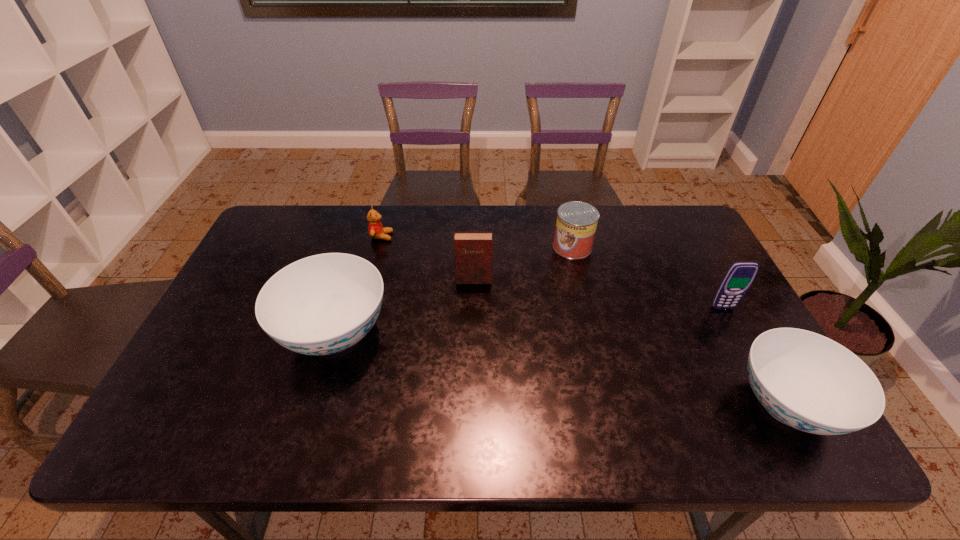
Identify the location of the left chinaware. Image resolution: width=960 pixels, height=540 pixels. (323, 304).

The width and height of the screenshot is (960, 540). Find the location of `the shorter chinaware`. the shorter chinaware is located at coordinates (805, 380).

Find the location of a particular element. Image resolution: width=960 pixels, height=540 pixels. the shortest object is located at coordinates (375, 228).

What are the coordinates of `cellular telephone` in the screenshot? It's located at (739, 277).

Identify the location of the third object from right to left. The height and width of the screenshot is (540, 960). (576, 224).

At what (x,y) coordinates should I click in order to perform the action: click on diary. Please return your answer as a coordinate pair (x, y). Looking at the image, I should click on (473, 251).

Where is `the fourth nearest object`? The image size is (960, 540). the fourth nearest object is located at coordinates (473, 251).

Find the location of a particular element. The height and width of the screenshot is (540, 960). vacant space located 0.390m on the back of the taller chinaware is located at coordinates (x=371, y=213).

Identify the location of vacant space located on the left of the shorter chinaware. (663, 405).

Identify the location of free location located on the front-facing side of the shortest object. (494, 237).